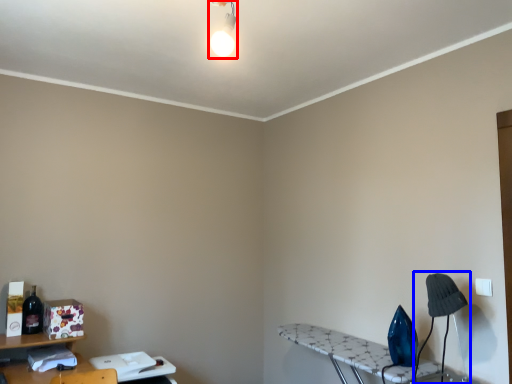
Question: Among these objects, which one is farthest to the camera, light fixture (highlighted by a red box) or table lamp (highlighted by a blue box)?

Choices:
 (A) light fixture
 (B) table lamp

Answer: (B)